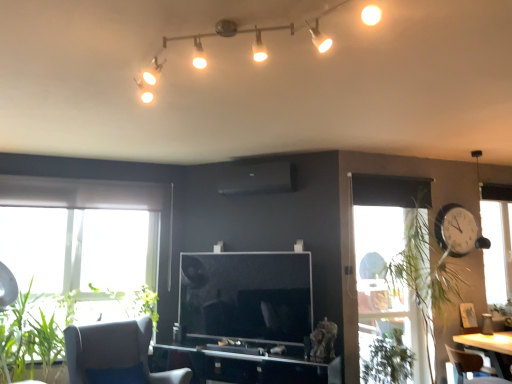
This screenshot has width=512, height=384. What do you see at coordinates (456, 230) in the screenshot?
I see `white plastic clock at right` at bounding box center [456, 230].

What do you see at coordinates (115, 354) in the screenshot?
I see `gray fabric chair at lower left, which appears as the first chair when viewed from the left` at bounding box center [115, 354].

Measure the distance between point (122, 382) and camera.

Point (122, 382) is 11.05 feet from camera.

Measure the distance between point (329,8) and camera.

A distance of 5.86 feet exists between point (329,8) and camera.

This screenshot has width=512, height=384. Identify the location of transparent glass computer desk at center. (254, 362).

What is the approximate width of green leafy plant at right, arranged as the first plant when viewed from the right?

It is 26.34 inches.

Locate an element on the screen. The height and width of the screenshot is (384, 512). white plastic clock at right is located at coordinates (456, 230).

Is green leafy plant at lower right, the second plant in the right-to-left sequence, facing towards green leafy plant at lower left, the 4th plant positioned from the right?

No, green leafy plant at lower right, the second plant in the right-to-left sequence, is not aimed at green leafy plant at lower left, the 4th plant positioned from the right.

Is green leafy plant at lower left, placed as the 1th plant when sorted from left to right, a part of green leafy plant at lower right, the second plant in the right-to-left sequence?

No.

Is green leafy plant at lower right, the second plant in the right-to-left sequence, to the right of green leafy plant at lower left, the 4th plant positioned from the right, from the viewer's perspective?

Yes.

Is point (401, 373) behind point (16, 292)?

No, (401, 373) is in front of (16, 292).

Considering the points (393, 335) and (446, 347), which point is behind, point (393, 335) or point (446, 347)?

The point (446, 347) is farther from the camera.

Based on the photo, which of these two, green leafy plant at lower right, the second plant in the right-to-left sequence, or brown leather chair at lower right, the second chair from the left, is bigger?

Bigger between the two is brown leather chair at lower right, the second chair from the left.

Is green leafy plant at lower right, the second plant in the right-to-left sequence, in contact with brown leather chair at lower right, which is the 1th chair in right-to-left order?

No, green leafy plant at lower right, the second plant in the right-to-left sequence, is not with brown leather chair at lower right, which is the 1th chair in right-to-left order.

How far apart are green leafy plant at lower right, placed as the third plant when sorted from left to right, and brown leather chair at lower right, the second chair from the left?

green leafy plant at lower right, placed as the third plant when sorted from left to right, is 23.51 inches from brown leather chair at lower right, the second chair from the left.

Which of these two, white plastic clock at right or green leafy plant at lower left, which is the 3th plant from right to left, is bigger?

Bigger between the two is green leafy plant at lower left, which is the 3th plant from right to left.

In the scene shown: Which is in front, white plastic clock at right or green leafy plant at lower left, which is the second plant from left to right?

green leafy plant at lower left, which is the second plant from left to right.

What's the angular difference between white plastic clock at right and green leafy plant at lower left, which is the 3th plant from right to left,'s facing directions?

white plastic clock at right and green leafy plant at lower left, which is the 3th plant from right to left, are facing 2.57 degrees away from each other.

Can you confirm if white plastic clock at right is taller than green leafy plant at lower left, which is the 3th plant from right to left?

No, white plastic clock at right is not taller than green leafy plant at lower left, which is the 3th plant from right to left.

How different are the orientations of brown leather chair at lower right, the second chair from the left, and transparent glass window at right in degrees?

The angular difference between brown leather chair at lower right, the second chair from the left, and transparent glass window at right is 81 degrees.

Does point (465, 357) appear closer or farther from the camera than point (505, 272)?

Point (465, 357) is closer to the camera than point (505, 272).

From the image's perspective, count 2nd chairs downward from the transparent glass window at right and point to it. Please provide its 2D coordinates.

[(470, 367)]

Which object is positioned more to the right, transparent glass computer desk at center or gray fabric chair at lower left, the 2th chair in the right-to-left sequence?

Positioned to the right is transparent glass computer desk at center.

Can gray fabric chair at lower left, the 2th chair in the right-to-left sequence, be found inside transparent glass computer desk at center?

Definitely not — gray fabric chair at lower left, the 2th chair in the right-to-left sequence, is not inside transparent glass computer desk at center.

Is the depth of transparent glass computer desk at center less than that of gray fabric chair at lower left, which appears as the first chair when viewed from the left?

No, transparent glass computer desk at center is behind gray fabric chair at lower left, which appears as the first chair when viewed from the left.

Does point (248, 364) appear closer or farther from the camera than point (90, 352)?

Point (248, 364) is positioned farther from the camera compared to point (90, 352).

Looking at the image, does matte white track lights at upper center seem bigger or smaller compared to brown leather chair at lower right, the second chair from the left?

In the image, matte white track lights at upper center appears to be larger than brown leather chair at lower right, the second chair from the left.

Would you say matte white track lights at upper center contains brown leather chair at lower right, the second chair from the left?

No, brown leather chair at lower right, the second chair from the left, is located outside of matte white track lights at upper center.

From a real-world perspective, which object stands above the other?

matte white track lights at upper center, from a real-world perspective.

Does point (110, 327) appear closer or farther from the camera than point (485, 207)?

Point (110, 327) appears to be closer to the viewer than point (485, 207).

Considering the relative sizes of gray fabric chair at lower left, which appears as the first chair when viewed from the left, and transparent glass window at right in the image provided, is gray fabric chair at lower left, which appears as the first chair when viewed from the left, shorter than transparent glass window at right?

Yes.

Is gray fabric chair at lower left, the 2th chair in the right-to-left sequence, oriented towards transparent glass window at right?

No, gray fabric chair at lower left, the 2th chair in the right-to-left sequence, is not turned towards transparent glass window at right.

Can you see gray fabric chair at lower left, which appears as the first chair when viewed from the left, touching transparent glass window at right?

No, gray fabric chair at lower left, which appears as the first chair when viewed from the left, is not next to transparent glass window at right.

Locate an element on the screen. This screenshot has height=384, width=512. plant that is the 2nd object to the right of the green leafy plant at lower left, the 4th plant positioned from the right, starting at the anchor is located at coordinates (388, 360).

At what (x,y) coordinates should I click in order to perform the action: click on chair that is the 1st one when counting upward from the green leafy plant at lower right, placed as the third plant when sorted from left to right (from the image's perspective). Please return your answer as a coordinate pair (x, y). The width and height of the screenshot is (512, 384). Looking at the image, I should click on (470, 367).

Based on their spatial positions, is white plastic clock at right or green leafy plant at lower right, placed as the third plant when sorted from left to right, closer to green leafy plant at lower left, which is the second plant from left to right?

Based on the image, green leafy plant at lower right, placed as the third plant when sorted from left to right, appears to be nearer to green leafy plant at lower left, which is the second plant from left to right.

Looking at the image, which one is located closer to transparent glass window at right, gray fabric chair at lower left, the 2th chair in the right-to-left sequence, or matte white track lights at upper center?

The object closer to transparent glass window at right is gray fabric chair at lower left, the 2th chair in the right-to-left sequence.

Estimate the real-world distances between objects in this image. Which object is further from green leafy plant at lower left, which is the second plant from left to right, green leafy plant at lower left, the 4th plant positioned from the right, or green leafy plant at right, arranged as the first plant when viewed from the right?

Among the two, green leafy plant at right, arranged as the first plant when viewed from the right, is located further to green leafy plant at lower left, which is the second plant from left to right.

From the image, which object appears to be nearer to matte white track lights at upper center, green leafy plant at lower left, placed as the 1th plant when sorted from left to right, or transparent glass window at right?

Among the two, green leafy plant at lower left, placed as the 1th plant when sorted from left to right, is located nearer to matte white track lights at upper center.

From the image, which object appears to be nearer to green leafy plant at lower right, the second plant in the right-to-left sequence, green leafy plant at right, arranged as the first plant when viewed from the right, or brown leather chair at lower right, the second chair from the left?

brown leather chair at lower right, the second chair from the left, is closer to green leafy plant at lower right, the second plant in the right-to-left sequence.

Which object lies nearer to the anchor point brown leather chair at lower right, which is the 1th chair in right-to-left order, matte white track lights at upper center or green leafy plant at right, arranged as the first plant when viewed from the right?

Based on the image, green leafy plant at right, arranged as the first plant when viewed from the right, appears to be nearer to brown leather chair at lower right, which is the 1th chair in right-to-left order.

Looking at the image, which one is located closer to green leafy plant at lower right, the second plant in the right-to-left sequence, transparent glass computer desk at center or green leafy plant at lower left, the 4th plant positioned from the right?

transparent glass computer desk at center.

Which object lies nearer to the anchor point brown leather chair at lower right, which is the 1th chair in right-to-left order, green leafy plant at right, arranged as the first plant when viewed from the right, or transparent glass computer desk at center?

The object closer to brown leather chair at lower right, which is the 1th chair in right-to-left order, is green leafy plant at right, arranged as the first plant when viewed from the right.

Find the location of a particular element. The width and height of the screenshot is (512, 384). chair located between green leafy plant at lower left, placed as the 1th plant when sorted from left to right, and green leafy plant at right, which ranks as the 4th plant in left-to-right order, in the left-right direction is located at coordinates (115, 354).

What are the coordinates of `chair between green leafy plant at lower left, the 4th plant positioned from the right, and transparent glass computer desk at center, in the horizontal direction` in the screenshot? It's located at (115, 354).

You are a GUI agent. You are given a task and a screenshot of the screen. Output one action in this format:
    pyautogui.click(x=<x>, y=<y>)
    Task: Click on the plant situated between green leafy plant at lower left, placed as the 1th plant when sorted from left to right, and green leafy plant at lower right, the second plant in the right-to-left sequence, from left to right
    The height and width of the screenshot is (384, 512).
    Given the screenshot: What is the action you would take?
    pyautogui.click(x=24, y=327)

Where is `computer desk between green leafy plant at lower left, which is the second plant from left to right, and transparent glass window at right from left to right`? This screenshot has height=384, width=512. computer desk between green leafy plant at lower left, which is the second plant from left to right, and transparent glass window at right from left to right is located at coordinates (254, 362).